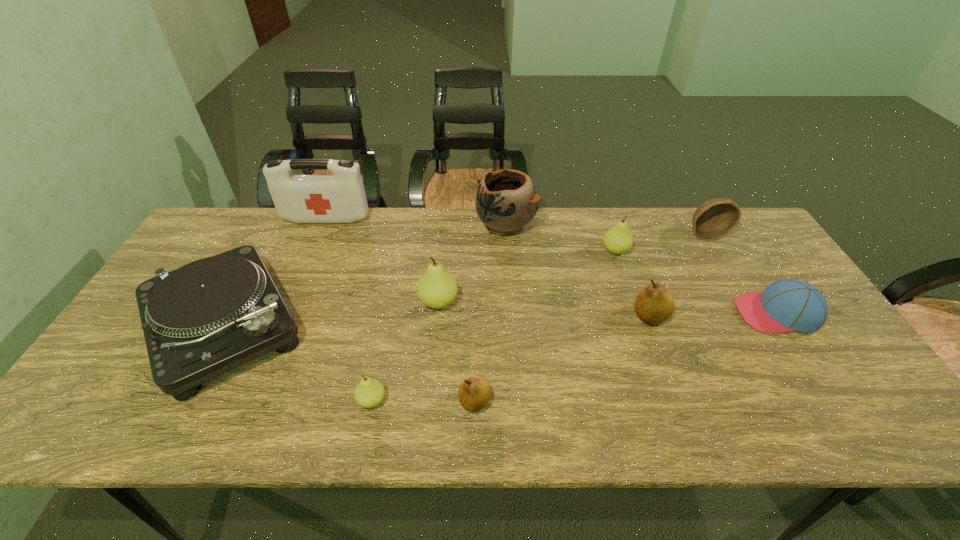
What are the coordinates of `record player` in the screenshot? It's located at (210, 316).

Locate an element on the screen. This screenshot has height=540, width=960. blue baseball cap is located at coordinates (787, 305).

The image size is (960, 540). Identify the location of the third pear from right to left. (474, 393).

The height and width of the screenshot is (540, 960). I want to click on the left brown pear, so click(474, 393).

Locate an element on the screen. the nearest green pear is located at coordinates (369, 392).

Identify the location of the leftmost green pear. (369, 392).

Where is `free region located 0.150m on the front side of the red first-aid kit`? This screenshot has height=540, width=960. free region located 0.150m on the front side of the red first-aid kit is located at coordinates (311, 254).

Find the location of `free spot located 0.270m on the left of the blue pottery`. free spot located 0.270m on the left of the blue pottery is located at coordinates (395, 225).

At what (x,y) coordinates should I click in order to perform the action: click on vacant area situated 0.400m on the left of the second green pear from left to right. Please return your answer as a coordinate pair (x, y). Looking at the image, I should click on (273, 302).

Locate an element on the screen. free space located 0.330m on the front of the bowl is located at coordinates (756, 320).